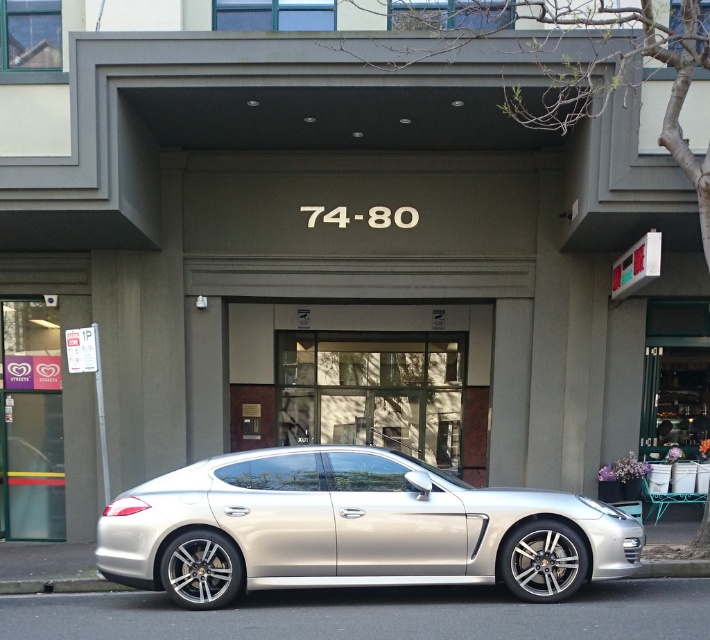
You are standing in front of the building and want to take a photo of the entrance. There are two points marked on your camera screen at coordinates point (442, 536) and point (430, 412). Which point is closer to you?

Point (442, 536) is closer to the viewer than point (430, 412).

You are a delivery person standing at the camera position. You need to deliver a package to the silver metallic car at center. Can you reach the car without crossing the street?

The silver metallic car at center and camera are 9.14 meters apart from each other. Since 9.14 meters is approximately 30 feet, you can easily walk to the silver metallic car at center without needing to cross the street.

You are a delivery person trying to unload a package from the silver metallic car at center. The clear glass door at center is the entrance to the building. Can you walk directly from the car to the door without going around anything?

The silver metallic car at center is positioned under clear glass door at center, so yes, you can walk directly from the silver metallic car at center to the clear glass door at center without needing to go around anything.